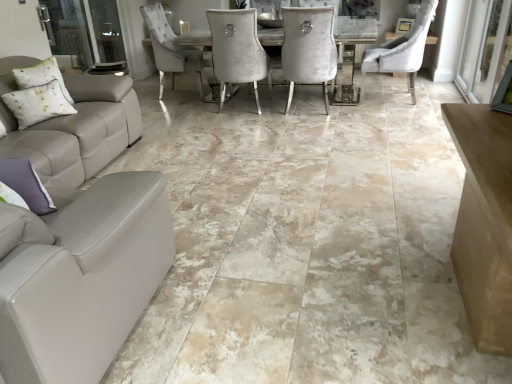
Question: Which direction should I rotate to face velvet beige chair at center, acting as the 2th chair starting from the left, — up or down?

Choices:
 (A) down
 (B) up

Answer: (B)

Question: From the image's perspective, is white textured pillow at left, marked as the first pillow in a back-to-front arrangement, on top of transparent glass screen door at right, placed as the 1th screen door when sorted from right to left?

Choices:
 (A) no
 (B) yes

Answer: (A)

Question: From the image's perspective, does white textured pillow at left, the 1th pillow when ordered from top to bottom, appear lower than transparent glass screen door at right, acting as the 2th screen door starting from the left?

Choices:
 (A) no
 (B) yes

Answer: (B)

Question: Does white textured pillow at left, the 2th pillow when ordered from bottom to top, come in front of transparent glass screen door at right, acting as the 2th screen door starting from the left?

Choices:
 (A) yes
 (B) no

Answer: (B)

Question: Is white textured pillow at left, the second pillow viewed from the front, looking in the opposite direction of transparent glass screen door at right, placed as the 1th screen door when sorted from right to left?

Choices:
 (A) yes
 (B) no

Answer: (B)

Question: Is white textured pillow at left, the second pillow viewed from the front, to the left of transparent glass screen door at right, placed as the 1th screen door when sorted from right to left, from the viewer's perspective?

Choices:
 (A) yes
 (B) no

Answer: (A)

Question: Does white textured pillow at left, marked as the first pillow in a back-to-front arrangement, have a lesser width compared to transparent glass screen door at right, acting as the 2th screen door starting from the left?

Choices:
 (A) no
 (B) yes

Answer: (A)

Question: Is white textured pillow at left, the 2th pillow in the right-to-left sequence, positioned in front of clear glass screen door at left, which appears as the second screen door when viewed from the right?

Choices:
 (A) no
 (B) yes

Answer: (B)

Question: Are white textured pillow at left, the 2th pillow when ordered from bottom to top, and clear glass screen door at left, which appears as the second screen door when viewed from the right, beside each other?

Choices:
 (A) yes
 (B) no

Answer: (B)

Question: Is white textured pillow at left, the 2th pillow in the right-to-left sequence, at the left side of clear glass screen door at left, which appears as the second screen door when viewed from the right?

Choices:
 (A) yes
 (B) no

Answer: (B)

Question: Considering the relative sizes of white textured pillow at left, positioned as the 1th pillow in left-to-right order, and clear glass screen door at left, acting as the 1th screen door starting from the left, in the image provided, is white textured pillow at left, positioned as the 1th pillow in left-to-right order, bigger than clear glass screen door at left, acting as the 1th screen door starting from the left,?

Choices:
 (A) yes
 (B) no

Answer: (B)

Question: Is clear glass screen door at left, acting as the 1th screen door starting from the left, located within white textured pillow at left, marked as the first pillow in a back-to-front arrangement?

Choices:
 (A) yes
 (B) no

Answer: (B)

Question: Considering the relative sizes of white textured pillow at left, the 2th pillow when ordered from bottom to top, and clear glass screen door at left, acting as the 1th screen door starting from the left, in the image provided, is white textured pillow at left, the 2th pillow when ordered from bottom to top, thinner than clear glass screen door at left, acting as the 1th screen door starting from the left,?

Choices:
 (A) no
 (B) yes

Answer: (A)

Question: Is purple fabric pillow at lower left, which is counted as the second pillow, starting from the top, oriented away from clear glass screen door at left, acting as the 1th screen door starting from the left?

Choices:
 (A) yes
 (B) no

Answer: (B)